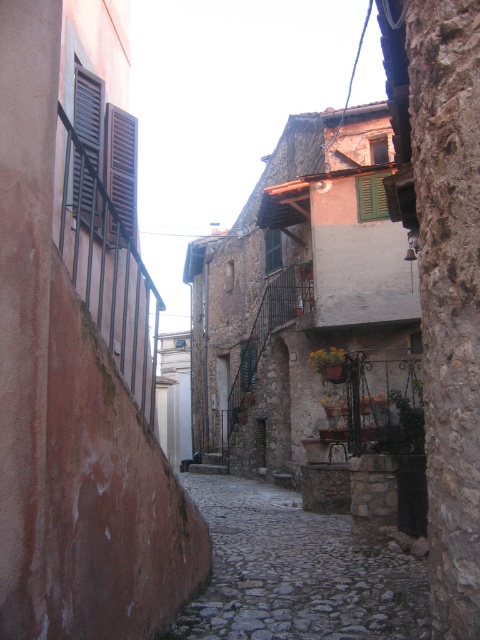
You are a delivery person carrying a large package and need to walk along the cobblestone path at center. There are matte black shutters at upper left above you. Can your package fit through the space between the path and the shutters without hitting anything?

The cobblestone path at center is wider than the matte black shutters at upper left, so the package should fit through the space between them without hitting anything.

You are a window installer assessing the space between the matte black shutters at left and the green matte shutter at upper center. Which shutter is taller?

The matte black shutters at left are taller than the green matte shutter at upper center.